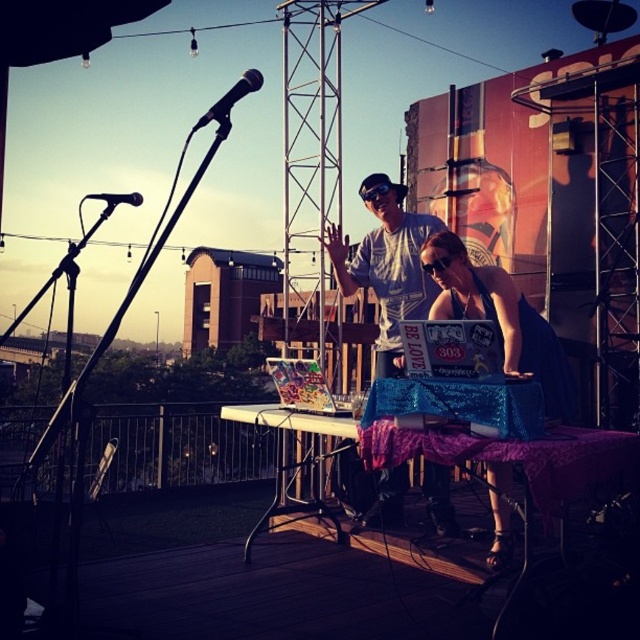
You are a stagehand responsible for setting up equipment. You have a 1.5 meter long extension cord that needs to be placed between the black matte microphone at upper center and the black matte microphone at upper left. Will the cord be long enough to connect them without needing to extend it further?

The distance between the black matte microphone at upper center and the black matte microphone at upper left is 1.45 meters. Since the extension cord is 1.5 meters long, it will be sufficient to connect them without needing to extend it further.